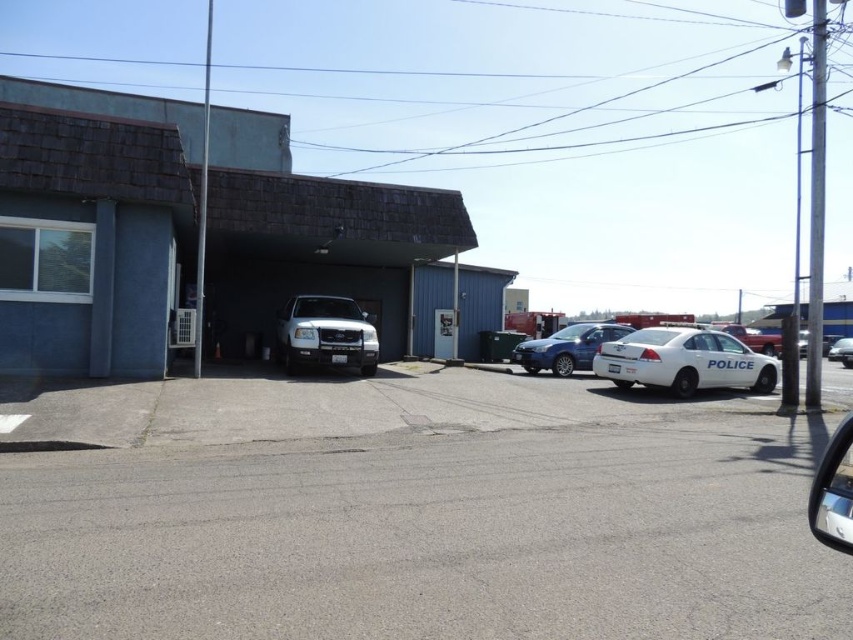
In the scene shown: Which of these two, satin blue sedan at center or white matte sedan at center, stands shorter?

white matte sedan at center

Can you confirm if satin blue sedan at center is wider than white matte sedan at center?

No.

Between point (602, 328) and point (850, 342), which one is positioned in front?

Point (602, 328) is more forward.

This screenshot has height=640, width=853. I want to click on satin blue sedan at center, so click(x=566, y=348).

Find the location of a particular element. gray asphalt parking lot at lower left is located at coordinates (425, 516).

Between gray asphalt parking lot at lower left and white matte suv at center, which one appears on the right side from the viewer's perspective?

gray asphalt parking lot at lower left is more to the right.

Is point (570, 540) less distant than point (311, 323)?

Yes, it is.

Find the location of a particular element. Image resolution: width=853 pixels, height=640 pixels. gray asphalt parking lot at lower left is located at coordinates (425, 516).

How much distance is there between white glossy police car at center-right and white matte sedan at center?

white glossy police car at center-right and white matte sedan at center are 15.23 feet apart.

Measure the distance from white glossy police car at center-right to white matte sedan at center.

The distance of white glossy police car at center-right from white matte sedan at center is 4.64 meters.

Measure the distance between point [759,333] and camera.

Point [759,333] and camera are 36.72 meters apart from each other.

Where is `white glossy police car at center-right`? white glossy police car at center-right is located at coordinates (753, 339).